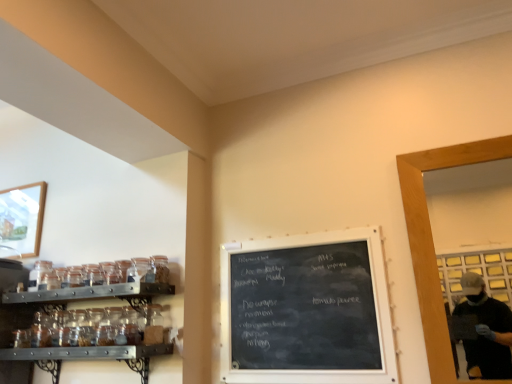
Measure the distance between point (494, 139) and camera.

Point (494, 139) is 1.88 meters away from camera.

The width and height of the screenshot is (512, 384). What do you see at coordinates (160, 268) in the screenshot?
I see `transparent glass jar at upper left, the second glass jar when ordered from back to front` at bounding box center [160, 268].

Find the location of a particular element. clear glass jar at left, which is the second glass jar in front-to-back order is located at coordinates (x=40, y=274).

Describe the element at coordinates (22, 218) in the screenshot. I see `wooden framed picture at upper left` at that location.

What do you see at coordinates (96, 293) in the screenshot? I see `clear glass jars at left` at bounding box center [96, 293].

This screenshot has height=384, width=512. What do you see at coordinates (307, 310) in the screenshot? I see `black chalkboard at center` at bounding box center [307, 310].

This screenshot has height=384, width=512. Find the location of `wooden frame at right`. wooden frame at right is located at coordinates (432, 238).

From a real-world perspective, is wooden framed picture at upper left located beneath transparent glass jar at upper left, acting as the 2th glass jar starting from the left?

No, from a real-world perspective, wooden framed picture at upper left is not beneath transparent glass jar at upper left, acting as the 2th glass jar starting from the left.

Considering the sizes of objects wooden framed picture at upper left and transparent glass jar at upper left, positioned as the 1th glass jar in right-to-left order, in the image provided, who is thinner, wooden framed picture at upper left or transparent glass jar at upper left, positioned as the 1th glass jar in right-to-left order,?

With smaller width is wooden framed picture at upper left.

Is the surface of wooden framed picture at upper left in direct contact with transparent glass jar at upper left, positioned as the 1th glass jar in right-to-left order?

No, wooden framed picture at upper left is not beside transparent glass jar at upper left, positioned as the 1th glass jar in right-to-left order.

Between wooden framed picture at upper left and transparent glass jar at upper left, positioned as the 1th glass jar in right-to-left order, which one appears on the left side from the viewer's perspective?

Positioned to the left is wooden framed picture at upper left.

Relative to wooden framed picture at upper left, is clear glass jars at left in front or behind?

clear glass jars at left is positioned closer to the viewer than wooden framed picture at upper left.

Which is correct: clear glass jars at left is inside wooden framed picture at upper left, or outside of it?

clear glass jars at left is located beyond the bounds of wooden framed picture at upper left.

Is clear glass jars at left positioned far away from wooden framed picture at upper left?

No, clear glass jars at left is in close proximity to wooden framed picture at upper left.

Looking at this image, who is taller, clear glass jars at left or wooden framed picture at upper left?

wooden framed picture at upper left is taller.

Considering the relative positions of clear glass jars at left and wooden frame at right in the image provided, is clear glass jars at left to the left or to the right of wooden frame at right?

Clearly, clear glass jars at left is on the left of wooden frame at right in the image.

Looking at this image, considering the relative sizes of clear glass jars at left and wooden frame at right in the image provided, is clear glass jars at left bigger than wooden frame at right?

Yes, clear glass jars at left is bigger than wooden frame at right.

From the image's perspective, is clear glass jar at left, the second glass jar when ordered from right to left, over black chalkboard at center?

Yes, from the image's perspective, clear glass jar at left, the second glass jar when ordered from right to left, is above black chalkboard at center.

Is the depth of clear glass jar at left, the second glass jar when ordered from right to left, less than that of black chalkboard at center?

No.

Is black chalkboard at center surrounded by clear glass jar at left, the 1th glass jar in the left-to-right sequence?

Definitely not — black chalkboard at center is not inside clear glass jar at left, the 1th glass jar in the left-to-right sequence.

In the scene shown: Is clear glass jar at left, the second glass jar when ordered from right to left, facing away from black chalkboard at center?

clear glass jar at left, the second glass jar when ordered from right to left, does not have its back to black chalkboard at center.

Is transparent glass jar at upper left, positioned as the 1th glass jar in right-to-left order, looking in the opposite direction of wooden framed picture at upper left?

No, transparent glass jar at upper left, positioned as the 1th glass jar in right-to-left order, is not facing away from wooden framed picture at upper left.

Does transparent glass jar at upper left, positioned as the 1th glass jar in right-to-left order, have a larger size compared to wooden framed picture at upper left?

Actually, transparent glass jar at upper left, positioned as the 1th glass jar in right-to-left order, might be smaller than wooden framed picture at upper left.

Which object is positioned more to the right, transparent glass jar at upper left, the second glass jar when ordered from back to front, or wooden framed picture at upper left?

transparent glass jar at upper left, the second glass jar when ordered from back to front.

Does transparent glass jar at upper left, acting as the 2th glass jar starting from the left, lie behind wooden framed picture at upper left?

That is False.

From the image's perspective, which is above, clear glass jars at left or transparent glass jar at upper left, the second glass jar when ordered from back to front?

transparent glass jar at upper left, the second glass jar when ordered from back to front.

Could you tell me if clear glass jars at left is turned towards transparent glass jar at upper left, positioned as the 1th glass jar in right-to-left order?

No, clear glass jars at left is not facing towards transparent glass jar at upper left, positioned as the 1th glass jar in right-to-left order.

Would you say clear glass jars at left is outside transparent glass jar at upper left, which ranks as the first glass jar in front-to-back order?

Indeed, clear glass jars at left is completely outside transparent glass jar at upper left, which ranks as the first glass jar in front-to-back order.

You are a GUI agent. You are given a task and a screenshot of the screen. Output one action in this format:
    pyautogui.click(x=<x>, y=<y>)
    Task: Click on the 1st glass jar behind the clear glass jars at left
    This screenshot has width=512, height=384.
    Given the screenshot: What is the action you would take?
    pyautogui.click(x=160, y=268)

Is transparent glass jar at upper left, positioned as the 1th glass jar in right-to-left order, next to wooden frame at right?

No, transparent glass jar at upper left, positioned as the 1th glass jar in right-to-left order, is not in contact with wooden frame at right.

Measure the distance between transparent glass jar at upper left, acting as the 2th glass jar starting from the left, and wooden frame at right.

A distance of 1.30 meters exists between transparent glass jar at upper left, acting as the 2th glass jar starting from the left, and wooden frame at right.

Where is `glass door located above the transparent glass jar at upper left, the second glass jar when ordered from back to front (from the image's perspective)`? glass door located above the transparent glass jar at upper left, the second glass jar when ordered from back to front (from the image's perspective) is located at coordinates (432, 238).

Locate an element on the screen. The image size is (512, 384). picture frame above the transparent glass jar at upper left, the second glass jar when ordered from back to front (from the image's perspective) is located at coordinates (22, 218).

The image size is (512, 384). I want to click on shelf in front of the wooden framed picture at upper left, so click(96, 293).

Considering their positions, is wooden framed picture at upper left positioned further to clear glass jars at left than wooden frame at right?

Among the two, wooden frame at right is located further to clear glass jars at left.

Estimate the real-world distances between objects in this image. Which object is closer to clear glass jars at left, transparent glass jar at upper left, which ranks as the first glass jar in front-to-back order, or wooden framed picture at upper left?

transparent glass jar at upper left, which ranks as the first glass jar in front-to-back order.

From the image, which object appears to be nearer to clear glass jar at left, the 1th glass jar in the left-to-right sequence, transparent glass jar at upper left, which ranks as the first glass jar in front-to-back order, or black chalkboard at center?

Based on the image, transparent glass jar at upper left, which ranks as the first glass jar in front-to-back order, appears to be nearer to clear glass jar at left, the 1th glass jar in the left-to-right sequence.

Which object lies further to the anchor point clear glass jars at left, clear glass jar at left, the 1th glass jar in the left-to-right sequence, or wooden frame at right?

wooden frame at right is further to clear glass jars at left.

Which object lies nearer to the anchor point clear glass jar at left, the second glass jar when ordered from right to left, wooden frame at right or wooden framed picture at upper left?

wooden framed picture at upper left is positioned closer to the anchor clear glass jar at left, the second glass jar when ordered from right to left.

Considering their positions, is transparent glass jar at upper left, positioned as the 1th glass jar in right-to-left order, positioned closer to black chalkboard at center than clear glass jars at left?

The object closer to black chalkboard at center is clear glass jars at left.

Which object lies nearer to the anchor point clear glass jar at left, the 1th glass jar in the left-to-right sequence, clear glass jars at left or transparent glass jar at upper left, the second glass jar when ordered from back to front?

Based on the image, clear glass jars at left appears to be nearer to clear glass jar at left, the 1th glass jar in the left-to-right sequence.

Estimate the real-world distances between objects in this image. Which object is further from wooden framed picture at upper left, clear glass jar at left, the first glass jar when ordered from back to front, or black chalkboard at center?

Among the two, black chalkboard at center is located further to wooden framed picture at upper left.

You are a GUI agent. You are given a task and a screenshot of the screen. Output one action in this format:
    pyautogui.click(x=<x>, y=<y>)
    Task: Click on the shelf located between wooden framed picture at upper left and black chalkboard at center in the left-right direction
    The image size is (512, 384).
    Given the screenshot: What is the action you would take?
    pyautogui.click(x=96, y=293)

Find the location of a particular element. This screenshot has height=384, width=512. glass jar located between clear glass jar at left, the 1th glass jar in the left-to-right sequence, and wooden frame at right in the left-right direction is located at coordinates (160, 268).

Find the location of `shelf located between clear glass jar at left, the 1th glass jar in the left-to-right sequence, and black chalkboard at center in the left-right direction`. shelf located between clear glass jar at left, the 1th glass jar in the left-to-right sequence, and black chalkboard at center in the left-right direction is located at coordinates (96, 293).

You are a GUI agent. You are given a task and a screenshot of the screen. Output one action in this format:
    pyautogui.click(x=<x>, y=<y>)
    Task: Click on the glass jar between wooden framed picture at upper left and transparent glass jar at upper left, the second glass jar when ordered from back to front
    
    Given the screenshot: What is the action you would take?
    pyautogui.click(x=40, y=274)